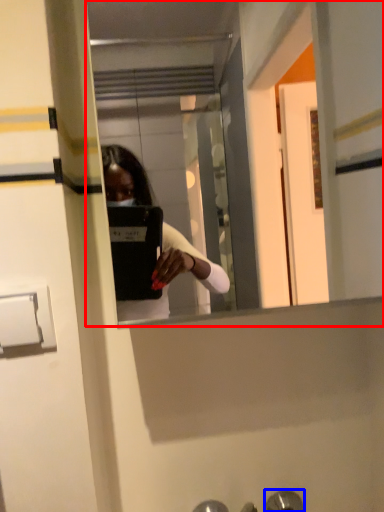
Question: Which of the following is the farthest to the observer, mirror (highlighted by a red box) or door handle (highlighted by a blue box)?

Choices:
 (A) mirror
 (B) door handle

Answer: (B)